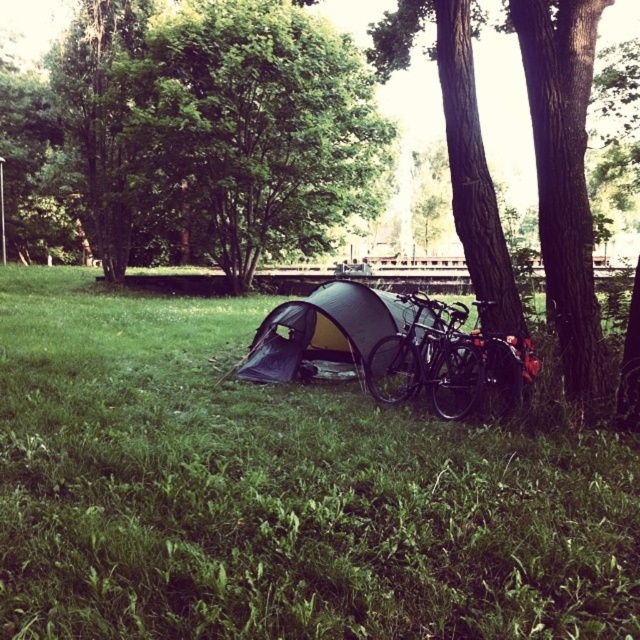
You are setting up a tent in the camping area. You want to place the green fabric tent at center so that it faces away from the green leafy tree at upper center. Is this possible based on their current positions?

The green leafy tree at upper center is to the left of green fabric tent at center, so if you want the tent to face away from the tree, you can position it facing to the right side opposite the tree.

You are standing at the center of the image and want to walk towards the green grass at lower center. What direction should you move in?

Since the green grass at lower center is located at point 0.772 on the x axis and 0.436 on the y axis, you should move towards the lower center direction to reach it.